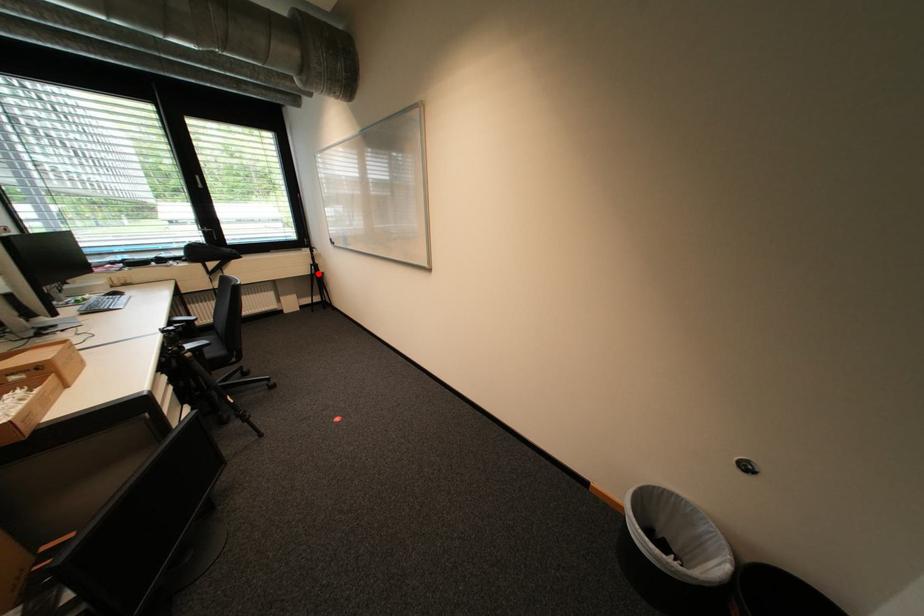
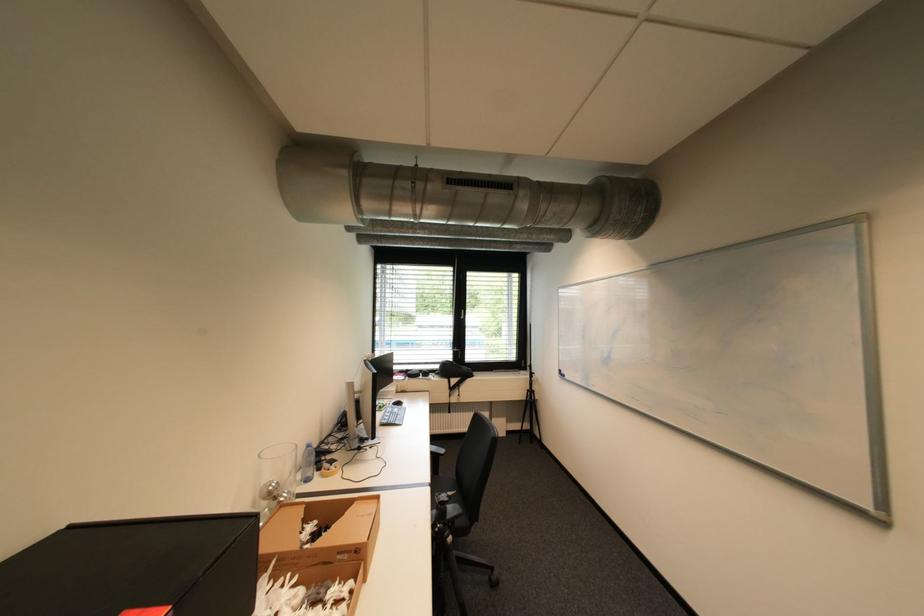
Question: I am providing you with two images of the same scene from different viewpoints. Image1 has a red point marked. In image2, the corresponding 3D location appears at what relative position? Reply with the corresponding letter.

Choices:
 (A) Closer
 (B) Farther

Answer: (B)